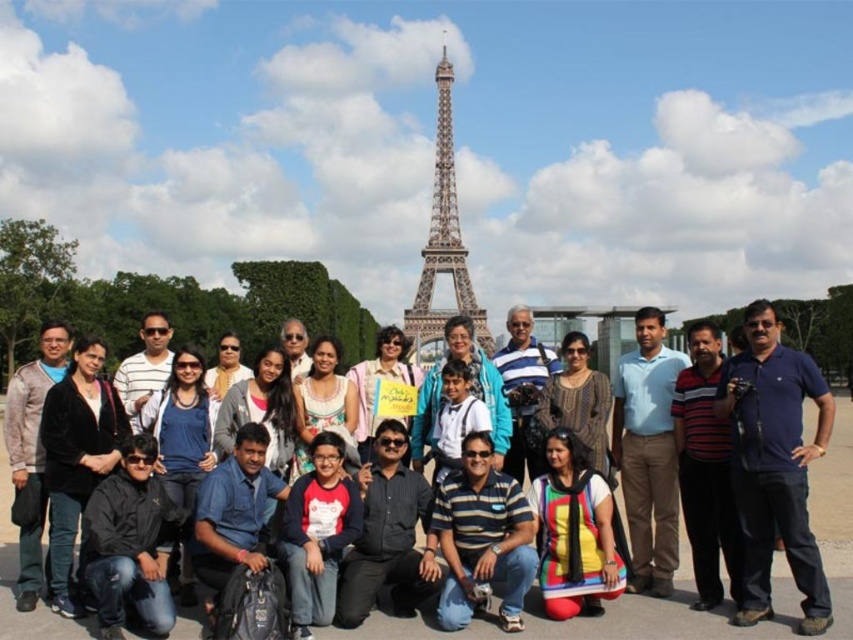
You are a photographer trying to capture the perfect shot of the matte pink shirt at center and the painted steel eiffel tower at center. Which object is located to the left of the other?

The matte pink shirt at center is positioned on the left side of the painted steel eiffel tower at center, so the matte pink shirt at center is to the left of the painted steel eiffel tower at center.

You are a photographer trying to capture a group photo. You have a camera with a fixed width of 1 meter. You want to ensure that both the black jacket at lower left and the matte gray sweater at center are fully in frame. Based on their widths, can you fit both within the camera frame?

The black jacket at lower left might be wider than matte gray sweater at center. Since the camera frame is 1 meter wide, it depends on the combined width of both objects. If the total width of both is less than or equal to 1 meter, they can fit. However, since the exact widths are not provided, it is uncertain.